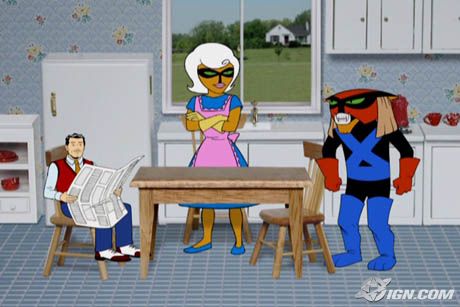
Identify the location of windows. This screenshot has height=307, width=460. (291, 85), (192, 23).